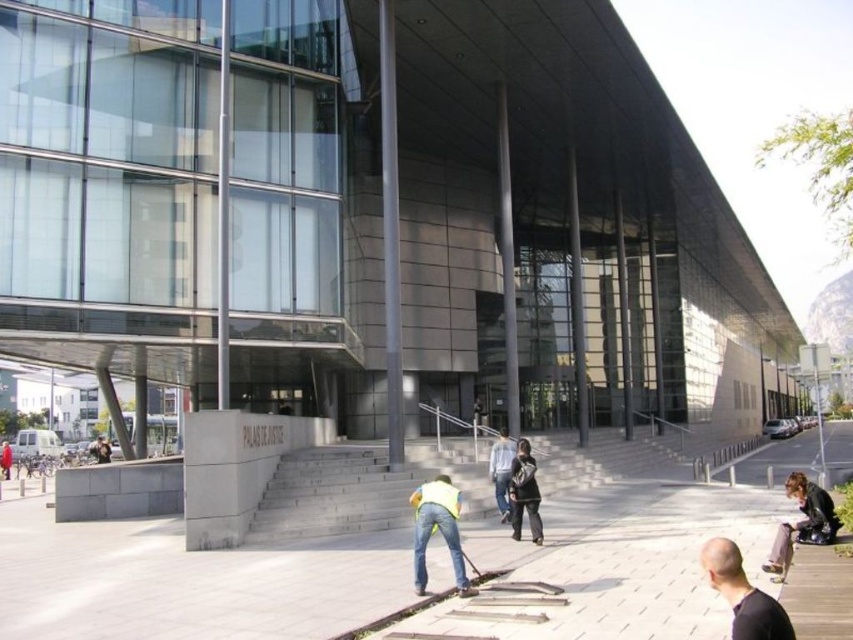
Question: Which object is positioned closest to the gray concrete stairs at center?

Choices:
 (A) light blue jeans at center
 (B) dark gray fabric jacket at center
 (C) yellow reflective vest at lower center
 (D) leather jacket at lower right

Answer: (A)

Question: Which of the following is the closest to the observer?

Choices:
 (A) (712, 572)
 (B) (595, 456)

Answer: (A)

Question: Does leather jacket at lower right lie behind dark gray fabric jacket at center?

Choices:
 (A) no
 (B) yes

Answer: (A)

Question: Which object appears closest to the camera in this image?

Choices:
 (A) yellow reflective vest at lower center
 (B) black matte shirt at lower right

Answer: (B)

Question: Is yellow reflective vest at lower center further to the viewer compared to leather jacket at lower right?

Choices:
 (A) no
 (B) yes

Answer: (A)

Question: Is black matte shirt at lower right closer to the viewer compared to leather jacket at lower right?

Choices:
 (A) no
 (B) yes

Answer: (B)